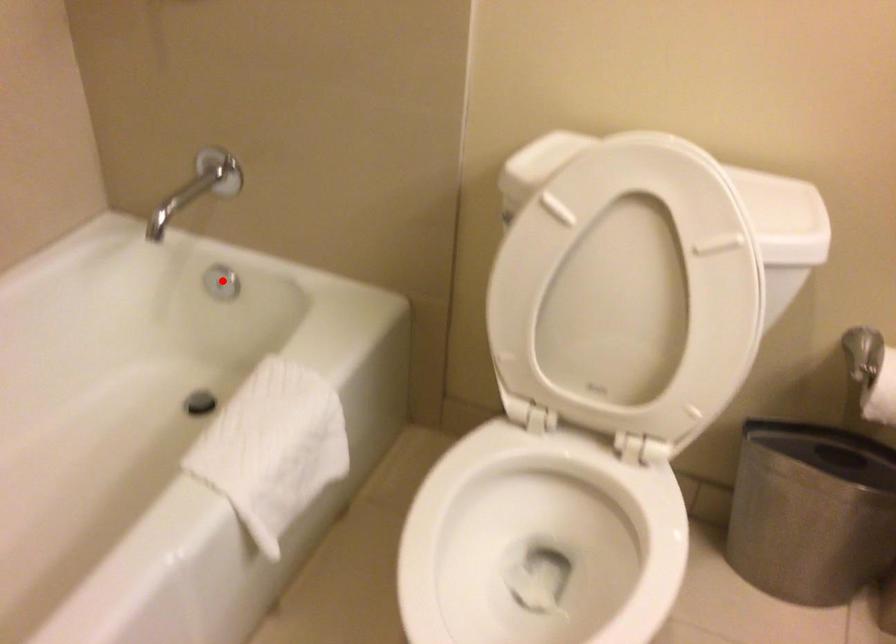
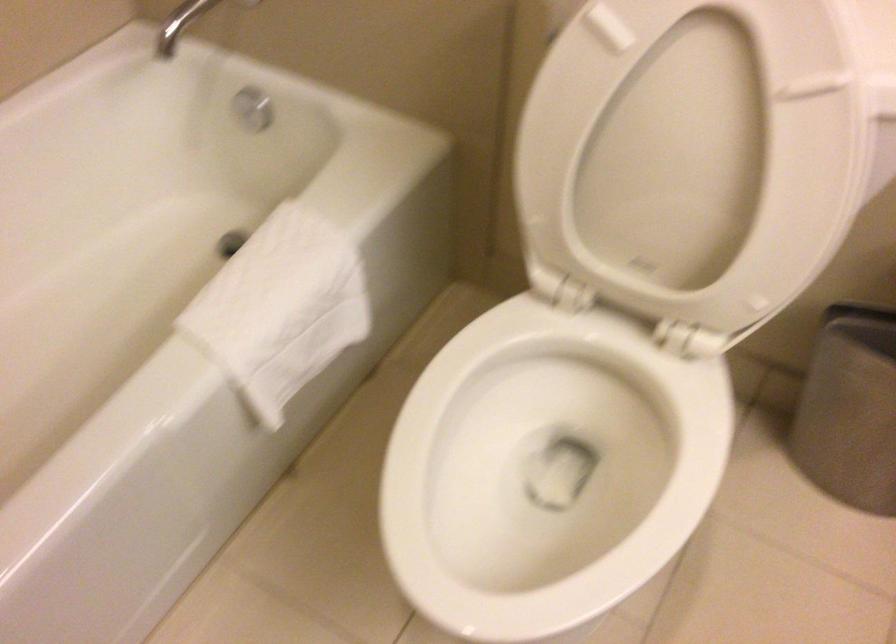
Locate, in the second image, the point that corresponds to the highlighted location in the first image.

(252, 108)